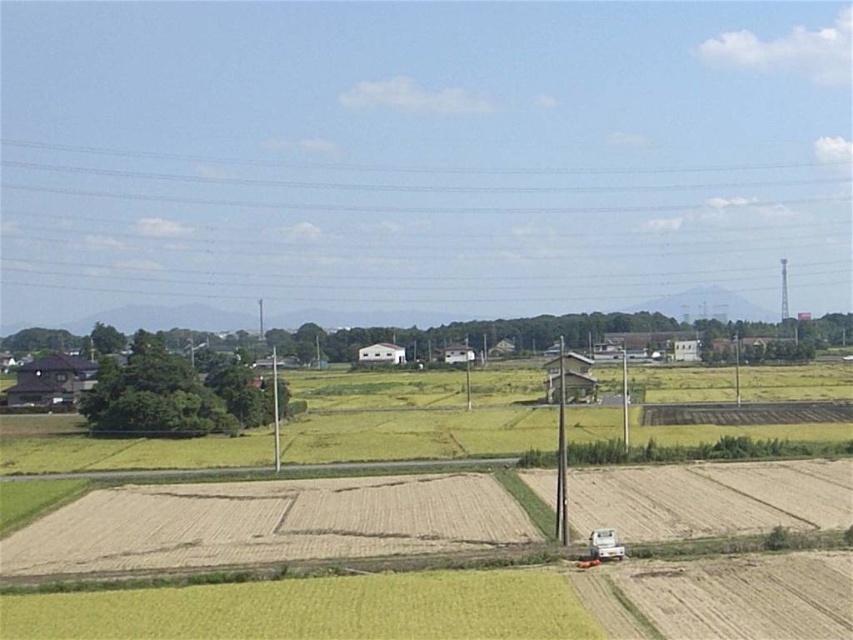
Question: Which of the following is the farthest from the observer?

Choices:
 (A) green grass field at center
 (B) green grassy field at lower center

Answer: (A)

Question: Is green grass field at center below green grassy field at lower center?

Choices:
 (A) yes
 (B) no

Answer: (B)

Question: Which point is closer to the camera taking this photo?

Choices:
 (A) (314, 593)
 (B) (606, 406)

Answer: (A)

Question: Is green grass field at center bigger than green grassy field at lower center?

Choices:
 (A) yes
 (B) no

Answer: (A)

Question: Which object appears closest to the camera in this image?

Choices:
 (A) green grass field at center
 (B) green grassy field at lower center

Answer: (B)

Question: Is green grass field at center positioned at the back of green grassy field at lower center?

Choices:
 (A) yes
 (B) no

Answer: (A)